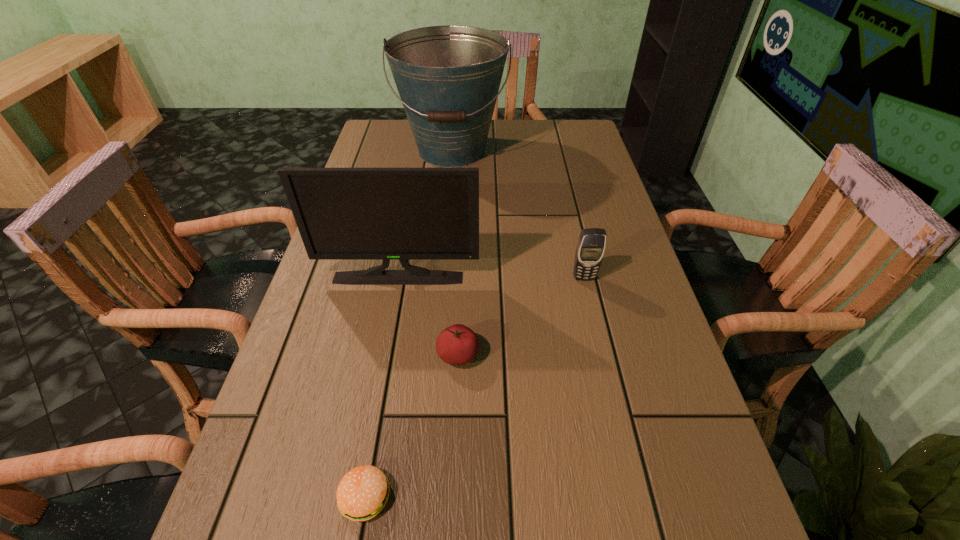
Find the location of `vacant area situated on the front-facing side of the fourth shortest object`. vacant area situated on the front-facing side of the fourth shortest object is located at coordinates (387, 336).

At what (x,y) coordinates should I click in order to perform the action: click on free region located on the front face of the third tallest object. Please return your answer as a coordinate pair (x, y). The height and width of the screenshot is (540, 960). Looking at the image, I should click on pyautogui.click(x=592, y=311).

At what (x,y) coordinates should I click in order to perform the action: click on vacant space located on the front of the fourth tallest object. Please return your answer as a coordinate pair (x, y). This screenshot has width=960, height=540. Looking at the image, I should click on (453, 480).

Identify the location of vacant space positioned 0.340m on the back of the patty. The height and width of the screenshot is (540, 960). (397, 312).

Locate an element on the screen. object located at the far edge is located at coordinates (448, 77).

Image resolution: width=960 pixels, height=540 pixels. I want to click on bucket at the left edge, so click(448, 77).

I want to click on monitor that is at the left edge, so click(403, 214).

Where is `object that is positioned at the right edge`? This screenshot has width=960, height=540. object that is positioned at the right edge is located at coordinates (590, 249).

This screenshot has width=960, height=540. I want to click on object that is at the far left corner, so click(448, 77).

In order to click on blank area at the far edge in this screenshot , I will do `click(514, 133)`.